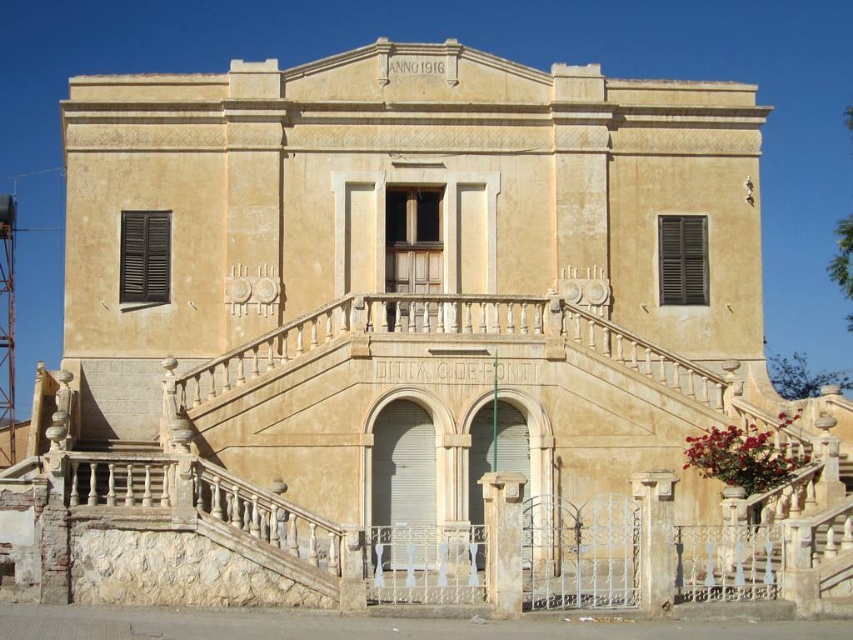
Question: Is matte black shutters at left above dark wood shutters at center?

Choices:
 (A) no
 (B) yes

Answer: (B)

Question: Among these objects, which one is nearest to the camera?

Choices:
 (A) matte black shutters at left
 (B) dark wood shutters at center

Answer: (A)

Question: Does matte black shutters at left have a smaller size compared to dark wood shutters at center?

Choices:
 (A) no
 (B) yes

Answer: (B)

Question: Which point is closer to the camera?

Choices:
 (A) (688, 284)
 (B) (160, 285)

Answer: (B)

Question: Can you confirm if matte black shutters at left is positioned to the right of dark wood shutters at center?

Choices:
 (A) no
 (B) yes

Answer: (A)